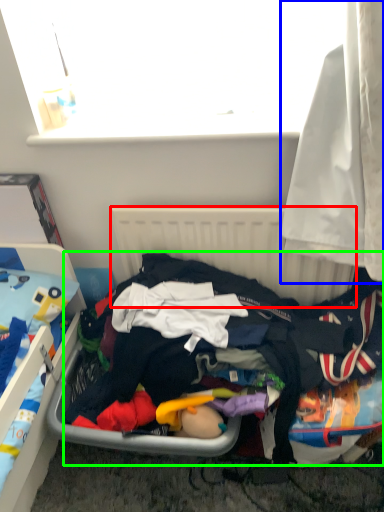
Question: Estimate the real-world distances between objects in this image. Which object is farther from radiator (highlighted by a red box), curtain (highlighted by a blue box) or clothing (highlighted by a green box)?

Choices:
 (A) curtain
 (B) clothing

Answer: (A)